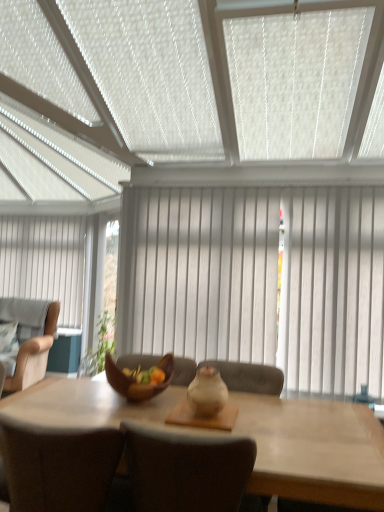
Question: Considering the positions of point (150, 456) and point (210, 215), is point (150, 456) closer or farther from the camera than point (210, 215)?

Choices:
 (A) farther
 (B) closer

Answer: (B)

Question: Which is correct: brown fabric chair at center, positioned as the 2th chair in right-to-left order, is inside white wood curtain at center, positioned as the second curtain in left-to-right order, or outside of it?

Choices:
 (A) inside
 (B) outside

Answer: (B)

Question: Estimate the real-world distances between objects in this image. Which object is closer to the beige fabric armchair at left, arranged as the first chair when viewed from the back?

Choices:
 (A) brown fabric chair at center, positioned as the 2th chair in right-to-left order
 (B) brown woven bowl at center
 (C) white wood curtain at center, positioned as the second curtain in left-to-right order
 (D) matte beige chair at center, arranged as the third chair when viewed from the left
 (E) light brown wooden table at center

Answer: (B)

Question: Considering the real-world distances, which object is closest to the white textured window blind at upper center?

Choices:
 (A) brown fabric chair at center, acting as the 3th chair starting from the back
 (B) white wood curtain at center, the second curtain in the back-to-front sequence
 (C) light brown wooden table at center
 (D) brown woven bowl at center
 (E) beige fabric armchair at left, the 1th chair viewed from the left

Answer: (B)